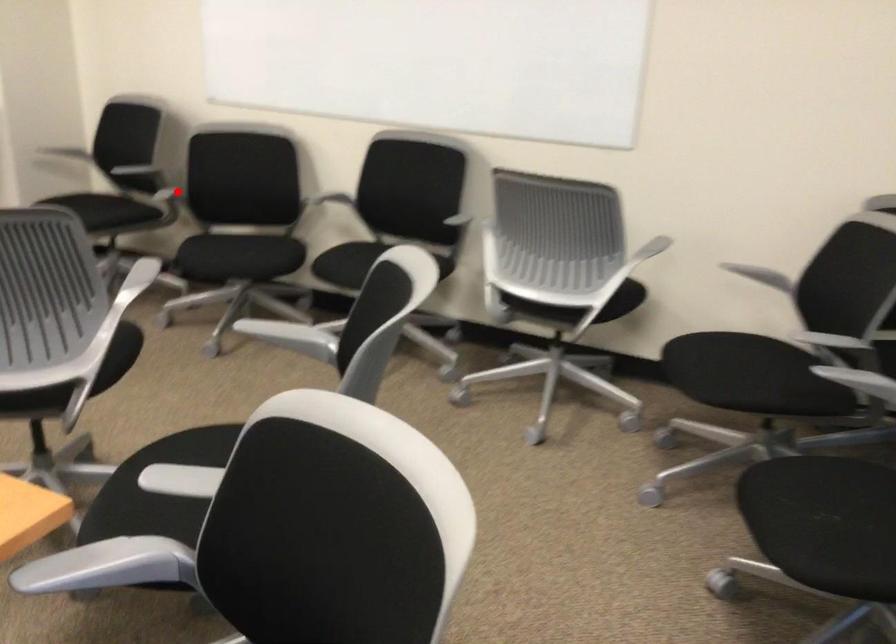
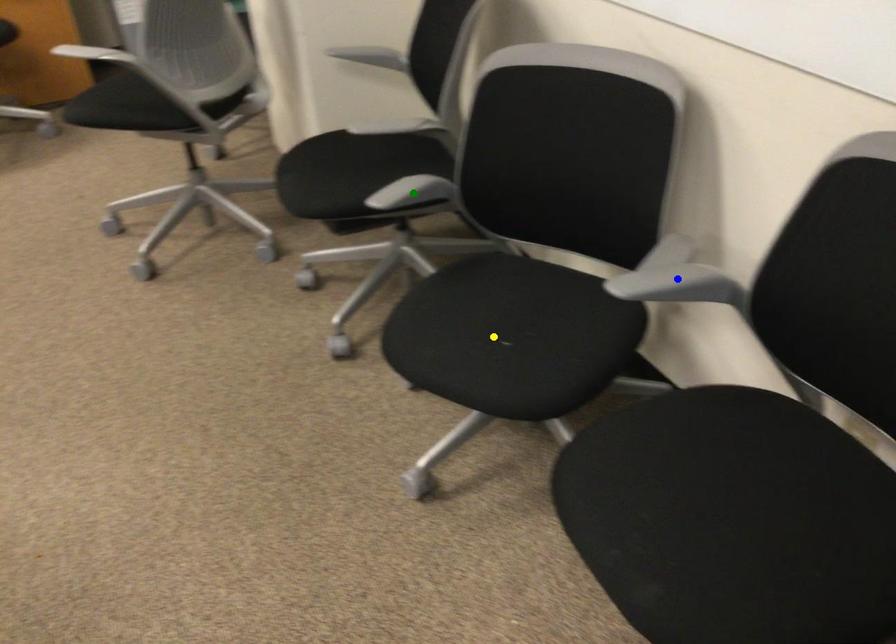
Question: I am providing you with two images of the same scene from different viewpoints. A red point is marked on the first image. You are given multiple points on the second image. Which point in image 2 is actually the same real-world point as the red point in image 1?

Choices:
 (A) yellow point
 (B) blue point
 (C) green point

Answer: (C)